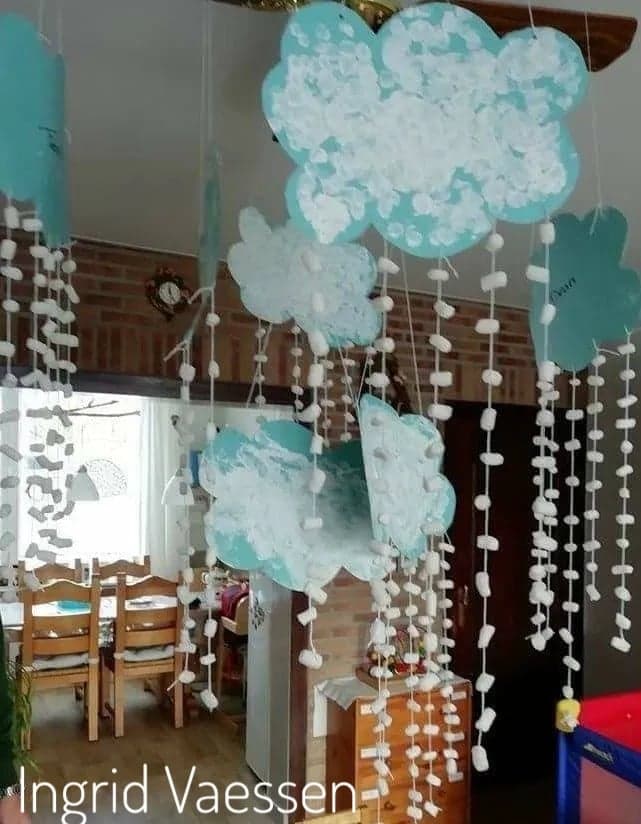
This screenshot has width=641, height=824. Find the location of `ceiling fan`. ceiling fan is located at coordinates (487, 5).